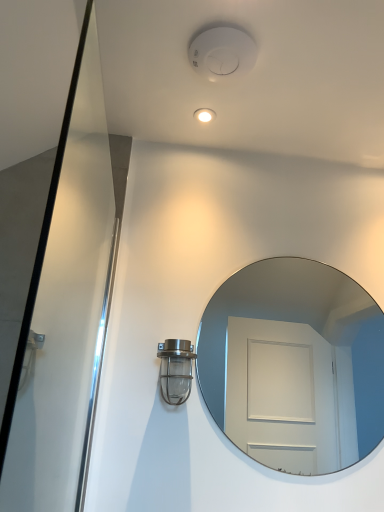
Question: Is metallic glass light fixture at lower left outside clear glass mirror at center?

Choices:
 (A) no
 (B) yes

Answer: (B)

Question: Is metallic glass light fixture at lower left bigger than clear glass mirror at center?

Choices:
 (A) yes
 (B) no

Answer: (B)

Question: From the image's perspective, is metallic glass light fixture at lower left beneath clear glass mirror at center?

Choices:
 (A) no
 (B) yes

Answer: (B)

Question: Is metallic glass light fixture at lower left oriented towards clear glass mirror at center?

Choices:
 (A) yes
 (B) no

Answer: (B)

Question: Is metallic glass light fixture at lower left positioned with its back to clear glass mirror at center?

Choices:
 (A) yes
 (B) no

Answer: (B)

Question: Is metallic glass light fixture at lower left at the right side of clear glass mirror at center?

Choices:
 (A) no
 (B) yes

Answer: (A)

Question: Is clear glass mirror at center not inside metallic glass light fixture at lower left?

Choices:
 (A) yes
 (B) no

Answer: (A)

Question: From the image's perspective, is clear glass mirror at center over metallic glass light fixture at lower left?

Choices:
 (A) no
 (B) yes

Answer: (B)

Question: Does clear glass mirror at center appear on the right side of metallic glass light fixture at lower left?

Choices:
 (A) no
 (B) yes

Answer: (B)

Question: From a real-world perspective, is clear glass mirror at center physically below metallic glass light fixture at lower left?

Choices:
 (A) no
 (B) yes

Answer: (A)

Question: From the image's perspective, is clear glass mirror at center located beneath metallic glass light fixture at lower left?

Choices:
 (A) no
 (B) yes

Answer: (A)

Question: Considering the relative sizes of clear glass mirror at center and metallic glass light fixture at lower left in the image provided, is clear glass mirror at center bigger than metallic glass light fixture at lower left?

Choices:
 (A) yes
 (B) no

Answer: (A)

Question: In the image, is clear glass mirror at center on the left side or the right side of metallic glass light fixture at lower left?

Choices:
 (A) right
 (B) left

Answer: (A)